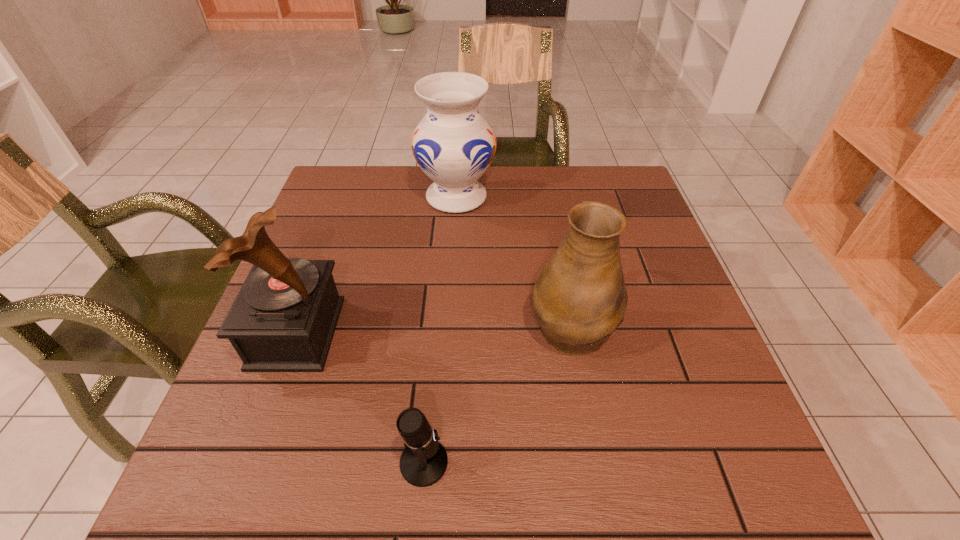
The image size is (960, 540). Find the location of `free location located 0.190m on the right of the nearest object`. free location located 0.190m on the right of the nearest object is located at coordinates (564, 462).

At what (x,y) coordinates should I click in order to perform the action: click on object at the far edge. Please return your answer as a coordinate pair (x, y). Image resolution: width=960 pixels, height=540 pixels. Looking at the image, I should click on (453, 144).

Where is `object that is positioned at the near edge`? The height and width of the screenshot is (540, 960). object that is positioned at the near edge is located at coordinates (423, 462).

What are the coordinates of `object that is at the left edge` in the screenshot? It's located at (284, 317).

You are a GUI agent. You are given a task and a screenshot of the screen. Output one action in this format:
    pyautogui.click(x=<x>, y=<y>)
    Task: Click on the vacant space at the far edge
    
    Given the screenshot: What is the action you would take?
    pyautogui.click(x=515, y=179)

Find the location of a particular element. The width and height of the screenshot is (960, 540). vacant space at the near edge of the desktop is located at coordinates (452, 454).

This screenshot has width=960, height=540. In the image, there is a desktop. Identify the location of vacant space at the left edge. (245, 428).

In the image, there is a desktop. At what (x,y) coordinates should I click in order to perform the action: click on vacant space at the right edge. Please return your answer as a coordinate pair (x, y). This screenshot has height=540, width=960. Looking at the image, I should click on (681, 281).

In the image, there is a desktop. Identify the location of vacant area at the near left corner. (281, 492).

Where is `free area in between the shortest object and the farthest object`? The image size is (960, 540). free area in between the shortest object and the farthest object is located at coordinates (441, 329).